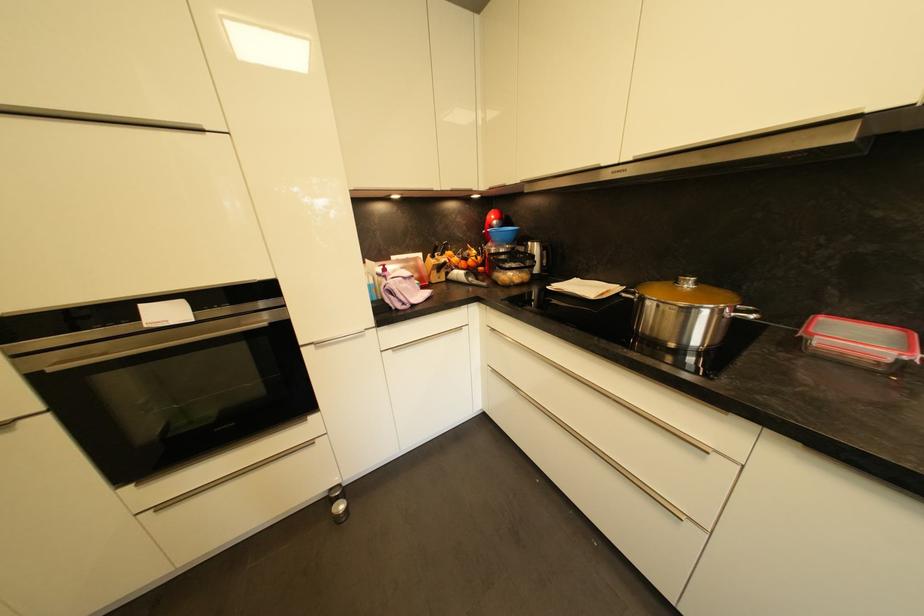
What do you see at coordinates (687, 286) in the screenshot? Image resolution: width=924 pixels, height=616 pixels. I see `a pot lid handle` at bounding box center [687, 286].